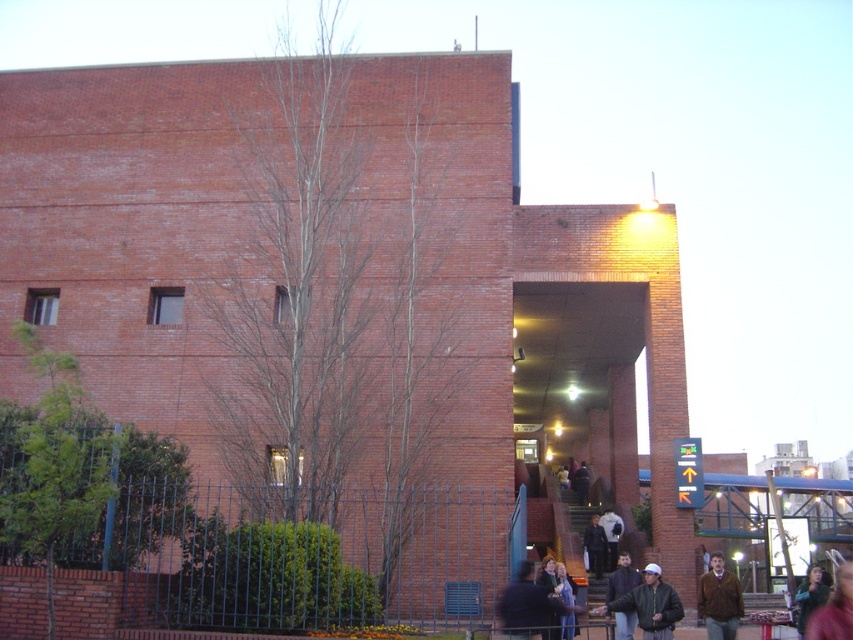
Question: Among these points, which one is farthest from the camera?

Choices:
 (A) (541, 624)
 (B) (566, 572)

Answer: (B)

Question: Can you confirm if black leather jacket at lower center is positioned above light brown leather jacket at lower center?

Choices:
 (A) yes
 (B) no

Answer: (A)

Question: Which point is closer to the camera taking this photo?

Choices:
 (A) (653, 568)
 (B) (811, 572)

Answer: (A)

Question: Is dark brown leather jacket at lower right above brown leather jacket at lower center?

Choices:
 (A) no
 (B) yes

Answer: (A)

Question: Can you confirm if brown leather jacket at lower right is smaller than brown leather jacket at lower center?

Choices:
 (A) yes
 (B) no

Answer: (A)

Question: Which point is farther to the camera?

Choices:
 (A) dark blue jacket at lower center
 (B) dark brown leather jacket at lower center
 (C) light brown leather jacket at lower center

Answer: (B)